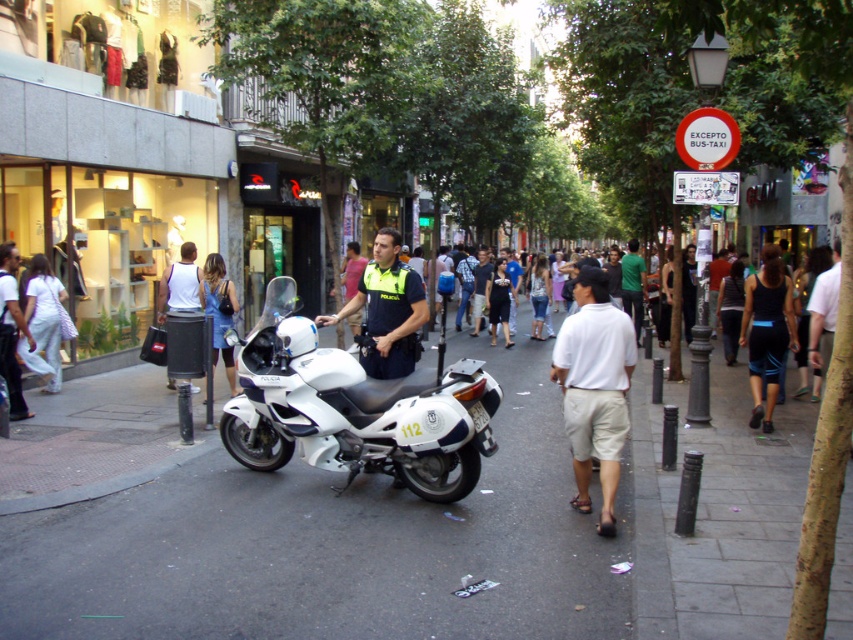
You are a pedestrian standing on the sidewalk and see the white asphalt at center and the white glossy motorcycle at center. Which object is closer to your right side?

The white glossy motorcycle at center is closer to your right side because the white asphalt at center is to its left.

You are a delivery person trying to park your 1.2 meter wide electric scooter. You see the white asphalt at center and the white glossy motorcycle at center. Which area can you park your scooter without overlapping the motorcycle?

The white asphalt at center is thinner than the white glossy motorcycle at center, so the scooter should be parked in the area where there is more space available, which is the white asphalt at center since it is thinner and narrower than the motorcycle, but wait that might not make sense. Hmm, maybe I need to clarify. Since the asphalt is thinner than the motorcycle, perhaps the motorcycle is wider. Therefore, the asphalt area might not be wide enough. Wait, the question is about parking without overlap. I